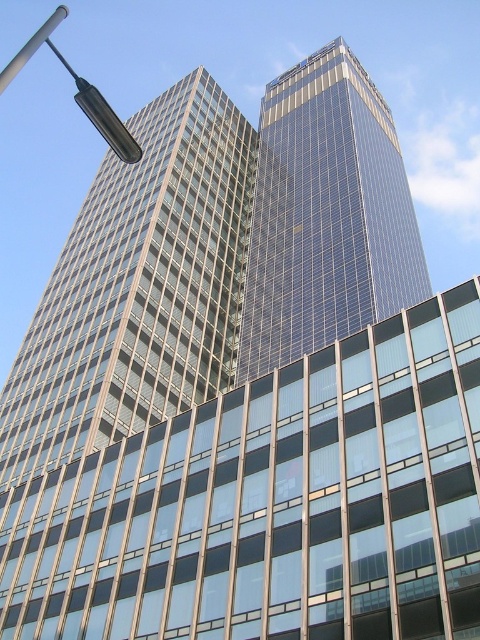
You are a drone operator trying to navigate between two points in the urban scene. You need to fly from point A to point B. If point A is point (345, 240) and point B is point (96, 93), will you fly towards the viewer or away from the viewer when moving from A to B?

When moving from point A to point B, you will be flying away from the viewer because point A is closer to the viewer than point B.

You are standing at the point marked as point (39, 38) in the urban scene. You want to take a photo of both buildings. Considering the distance between you and the buildings, will you be able to capture both buildings in a single frame without moving?

The point (39, 38) is 893.10 feet away from the viewer. Since both buildings are in the same scene and the distance is measured from the point to the viewer, it is likely that both buildings can be captured in a single frame as they are part of the same urban scene. However, the exact framing depends on the camera angle and lens used.

You are standing in front of the two high rise buildings in the image. There are two points marked on the buildings. Point A is at coordinate point [48,33] and Point B is at coordinate point [63,10]. Which point is closer to you?

Point A at coordinate point [48,33] is closer to the viewer than point B at coordinate point [63,10].